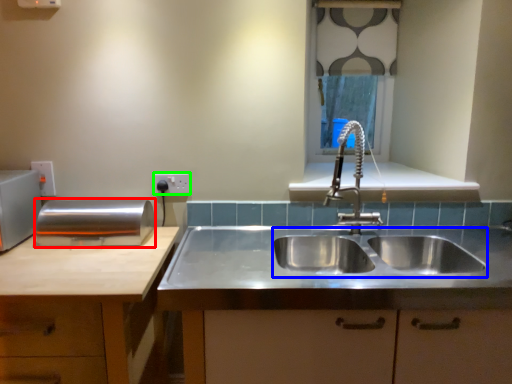
Question: Which object is positioned farthest from appliance (highlighted by a red box)? Select from sink (highlighted by a blue box) and electric outlet (highlighted by a green box).

Choices:
 (A) sink
 (B) electric outlet

Answer: (A)